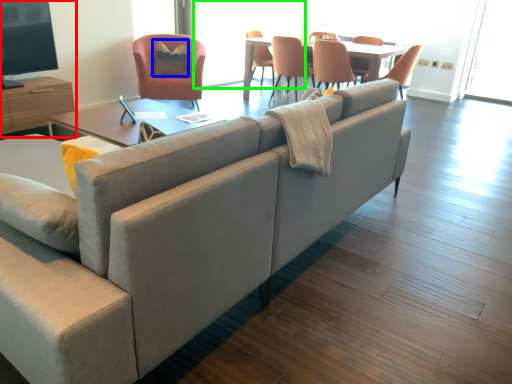
Question: Considering the real-world distances, which object is closest to entertainment center (highlighted by a red box)? pillow (highlighted by a blue box) or window screen (highlighted by a green box).

Choices:
 (A) pillow
 (B) window screen

Answer: (A)